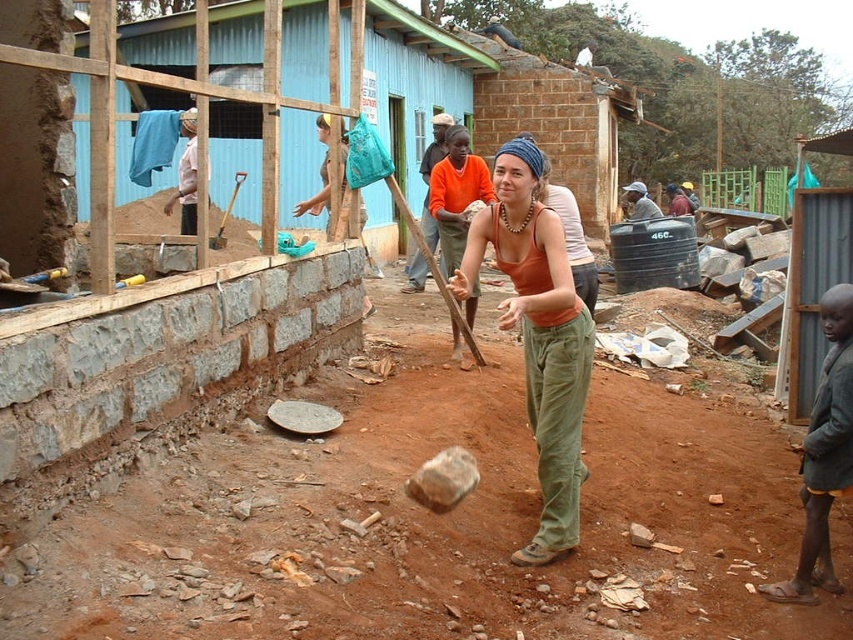
Is orange shirt at center further to the viewer compared to wooden handle shovel at center?

No, it is not.

Between point (433, 145) and point (236, 188), which one is positioned behind?

The point (236, 188) is behind.

Who is more distant from viewer, (x=419, y=253) or (x=239, y=188)?

The point (x=239, y=188) is more distant.

Identify the location of orange shirt at center. [x=430, y=173].

Who is taller, orange cotton tank top at center or matte orange shirt at center?

orange cotton tank top at center

Describe the element at coordinates (538, 333) in the screenshot. This screenshot has height=640, width=853. I see `orange cotton tank top at center` at that location.

Which is behind, point (567, 480) or point (447, 227)?

The point (447, 227) is behind.

Find the location of `orange cotton tank top at center`. orange cotton tank top at center is located at coordinates (538, 333).

Between brown dirt field at center and light brown fabric at upper left, which one has more height?

With more height is light brown fabric at upper left.

Which is above, brown dirt field at center or light brown fabric at upper left?

light brown fabric at upper left is above.

The height and width of the screenshot is (640, 853). Identify the location of brown dirt field at center. (436, 524).